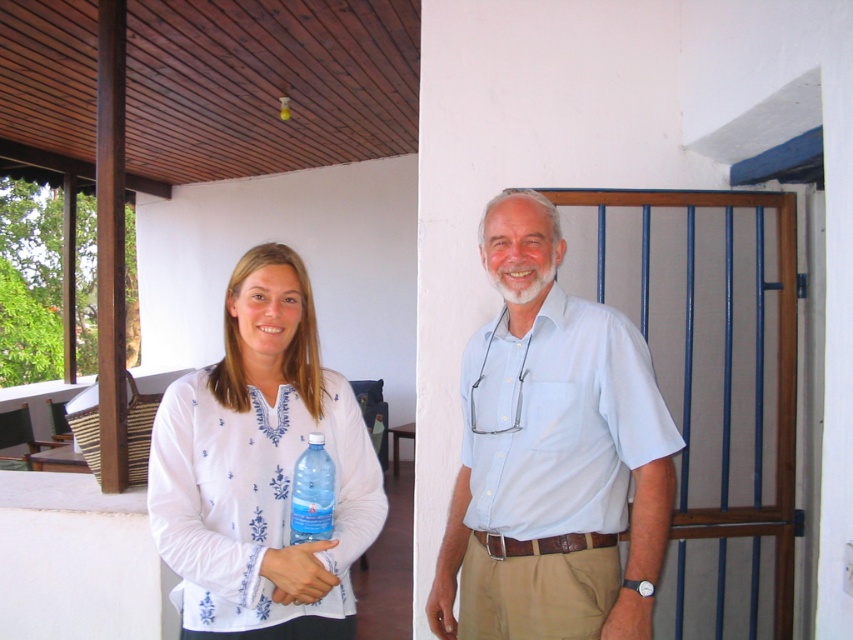
Between point (300, 568) and point (302, 464), which one is positioned in front?

Point (300, 568) is more forward.

Can you confirm if white embroidered shirt at left is positioned above transparent plastic bottle at center?

Yes.

The width and height of the screenshot is (853, 640). What are the coordinates of `white embroidered shirt at left` in the screenshot? It's located at (260, 468).

Locate an element on the screen. The height and width of the screenshot is (640, 853). white embroidered shirt at left is located at coordinates (260, 468).

Does light blue cotton shirt at center come in front of transparent plastic bottle at center?

No, it is behind transparent plastic bottle at center.

Does light blue cotton shirt at center appear under transparent plastic bottle at center?

Incorrect, light blue cotton shirt at center is not positioned below transparent plastic bottle at center.

Measure the distance between point (515,360) and camera.

The distance of point (515,360) from camera is 1.82 meters.

The width and height of the screenshot is (853, 640). What are the coordinates of `light blue cotton shirt at center` in the screenshot? It's located at (552, 456).

Who is taller, light blue cotton shirt at center or white embroidered shirt at left?

light blue cotton shirt at center is taller.

Which is behind, point (566, 600) or point (297, 400)?

Point (297, 400)

What are the coordinates of `light blue cotton shirt at center` in the screenshot? It's located at (552, 456).